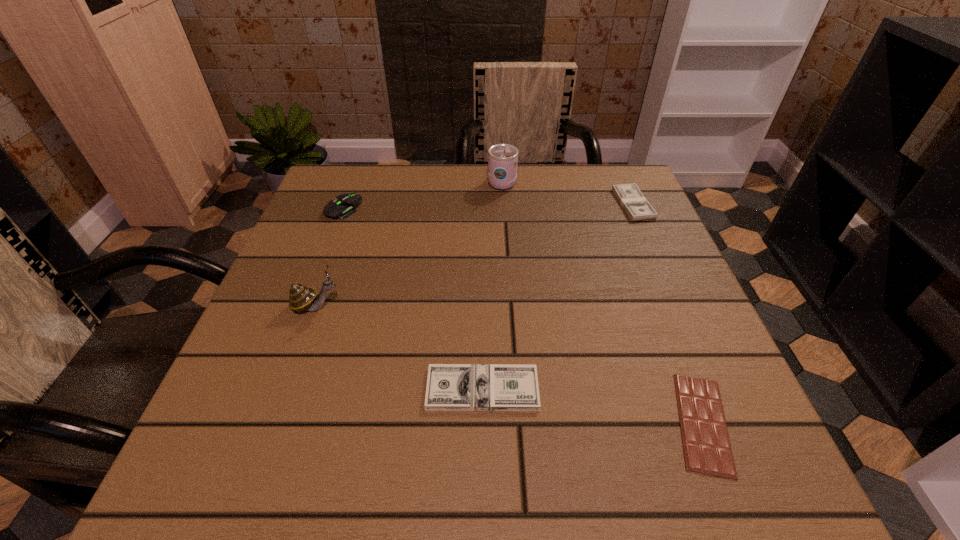
The image size is (960, 540). I want to click on free location located 0.170m on the front of the fourth shortest object, so tap(319, 271).

You are a GUI agent. You are given a task and a screenshot of the screen. Output one action in this format:
    pyautogui.click(x=<x>, y=<y>)
    Task: Click on the free point located 0.390m on the left of the third shortest object
    
    Given the screenshot: What is the action you would take?
    pyautogui.click(x=457, y=204)

I want to click on free space located on the right of the shorter dollar, so click(694, 389).

Where is `vacant region located on the left of the shortest object`? The height and width of the screenshot is (540, 960). vacant region located on the left of the shortest object is located at coordinates (564, 423).

Where is `cup that is positioned at the far edge`? Image resolution: width=960 pixels, height=540 pixels. cup that is positioned at the far edge is located at coordinates [x=502, y=158].

Identify the location of computer mouse that is at the far edge. (347, 203).

Identify the location of dollar that is at the far edge. The width and height of the screenshot is (960, 540). (x=636, y=206).

Where is `object that is at the near edge`? The image size is (960, 540). object that is at the near edge is located at coordinates (707, 449).

This screenshot has height=540, width=960. I want to click on snail located at the left edge, so click(x=301, y=298).

Identify the location of computer mouse at the left edge. This screenshot has width=960, height=540. (347, 203).